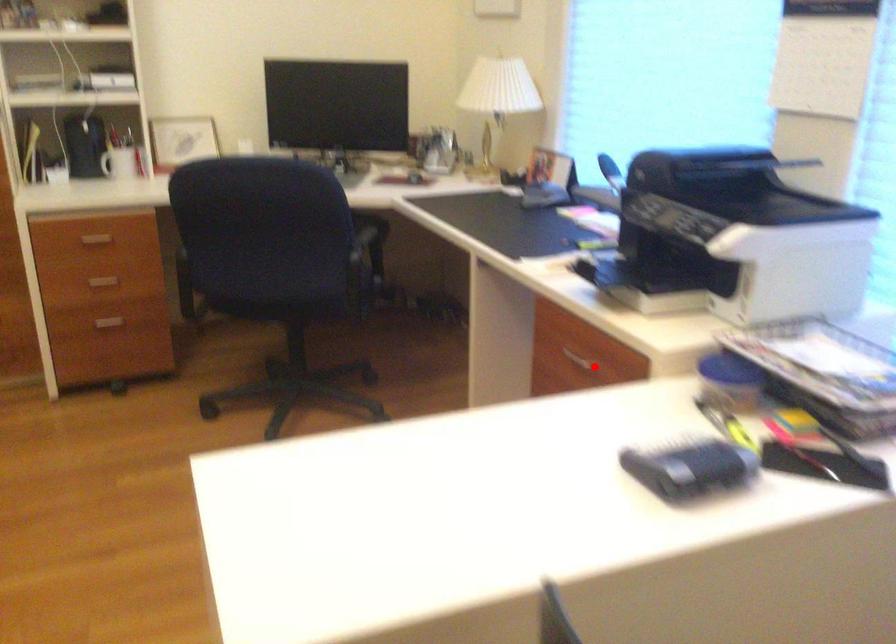
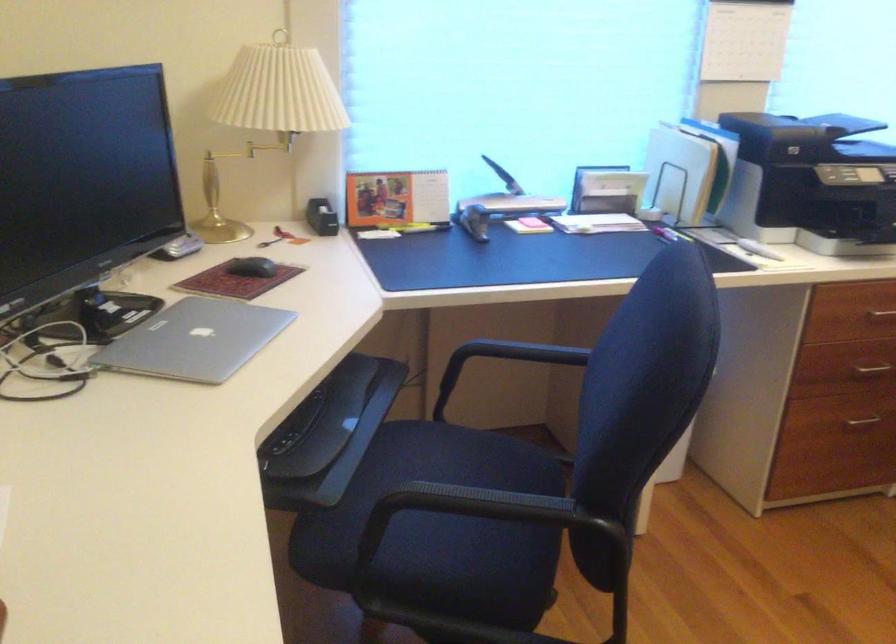
Question: A red point is marked in image1. In image2, is the corresponding 3D point closer to the camera or farther? Reply with the corresponding letter.

Choices:
 (A) The corresponding 3D point is closer.
 (B) The corresponding 3D point is farther.

Answer: (B)